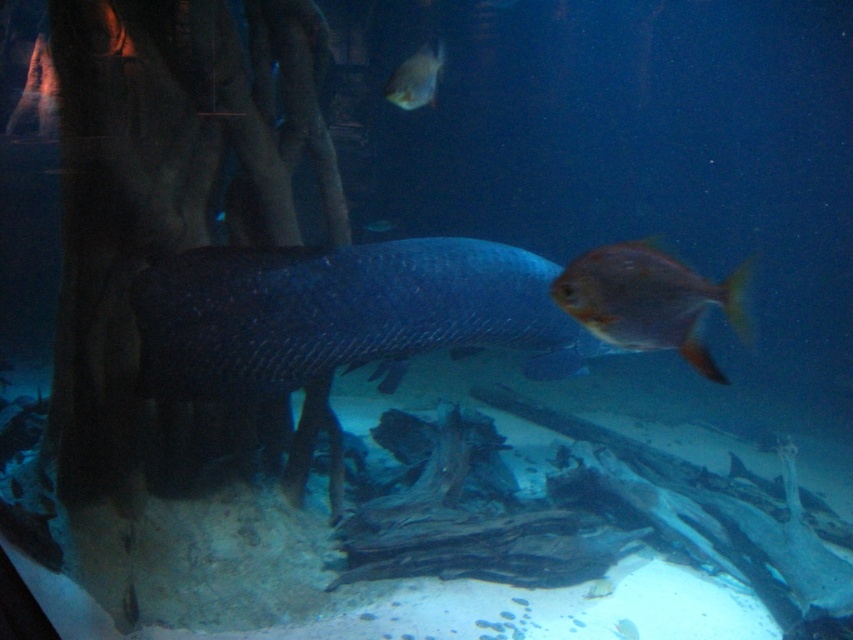
You are an underwater photographer aiming to capture a photo of the shiny orange fish at upper right and the shiny silver fish at upper center. Which fish should you focus on first if you want to photograph them both in the same frame?

You should focus on the shiny silver fish at upper center first because it is shorter than the shiny orange fish at upper right, allowing you to adjust the framing to include both in the shot.